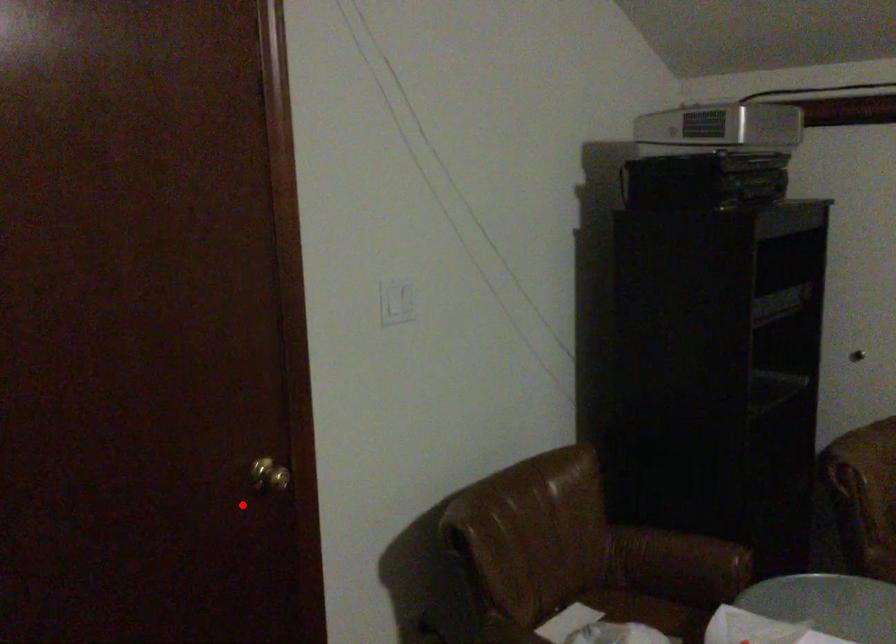
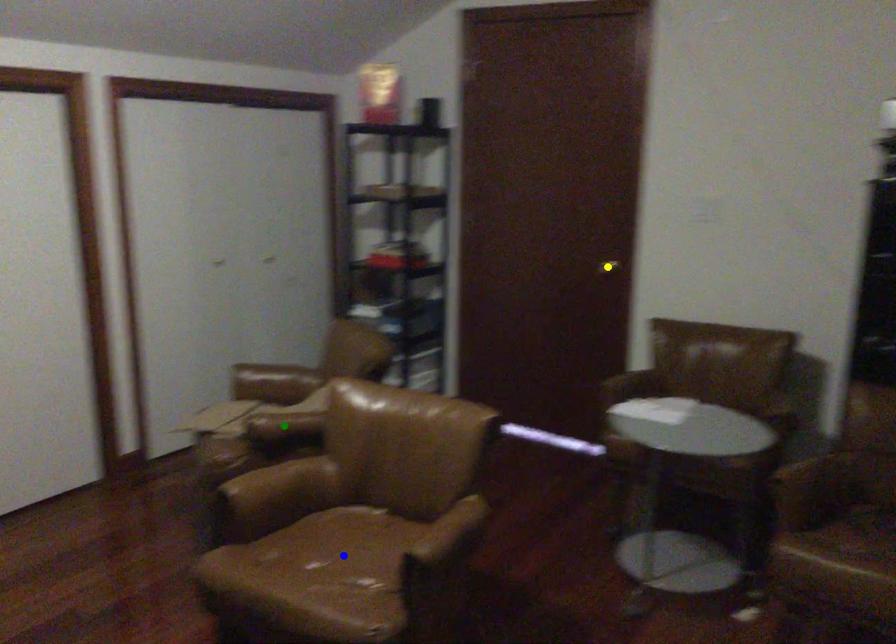
Question: I am providing you with two images of the same scene from different viewpoints. A red point is marked on the first image. You are given multiple points on the second image. Which mark in image 2 goes with the point in image 1?

Choices:
 (A) green point
 (B) blue point
 (C) yellow point

Answer: (C)